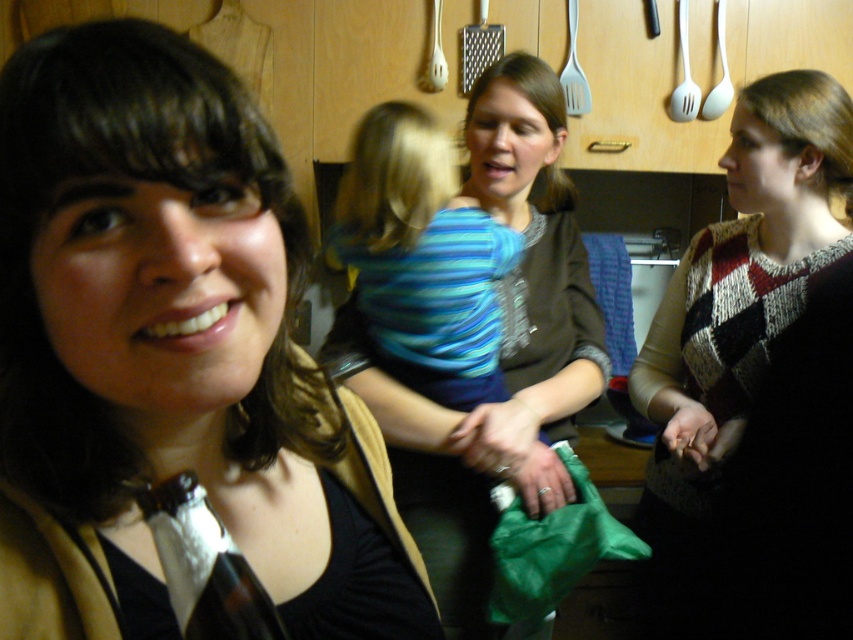
You are trying to decide which sweater to wear for a cold day. Both the matte brown sweater at center and the knitted sweater at center are available. Which one would you choose based on their thickness?

The knitted sweater at center is thicker than the matte brown sweater at center, so it would be a better choice for a cold day.

You are standing at point (x=791, y=173) and want to move to point (x=590, y=324). Is the path between these two points clear?

Point (x=590, y=324) is behind point (x=791, y=173), so the path between them is blocked by the objects at point (x=791, y=173).

You are a photographer standing in the kitchen scene. You need to place a 24 inch wide decorative shelf between the matte black jacket at left and the matte brown sweater at center. Will the shelf fit between them?

The matte black jacket at left and the matte brown sweater at center are 28.28 inches apart from each other. Since the shelf is 24 inches wide, it will fit between them with about 2.14 inches of space remaining on either side.